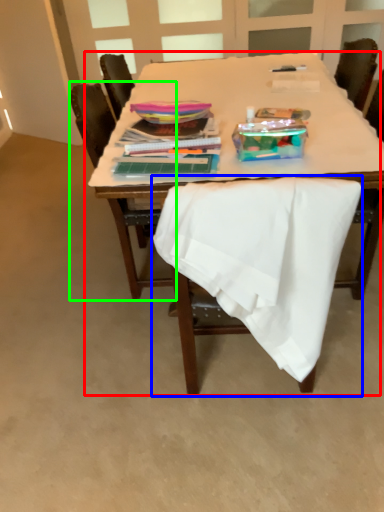
Question: Which object is positioned closest to table (highlighted by a red box)? Select from chair (highlighted by a blue box) and chair (highlighted by a green box).

Choices:
 (A) chair
 (B) chair

Answer: (B)